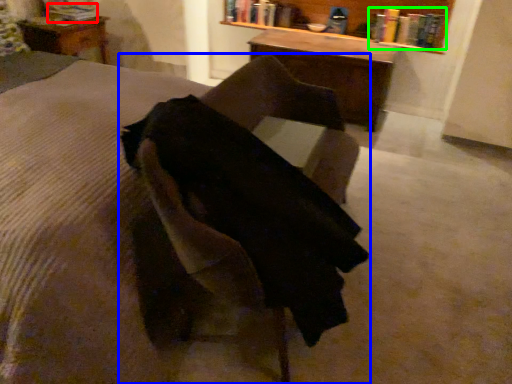
Question: Which object is positioned farthest from book (highlighted by a red box)? Select from chair (highlighted by a blue box) and book (highlighted by a green box).

Choices:
 (A) chair
 (B) book

Answer: (A)